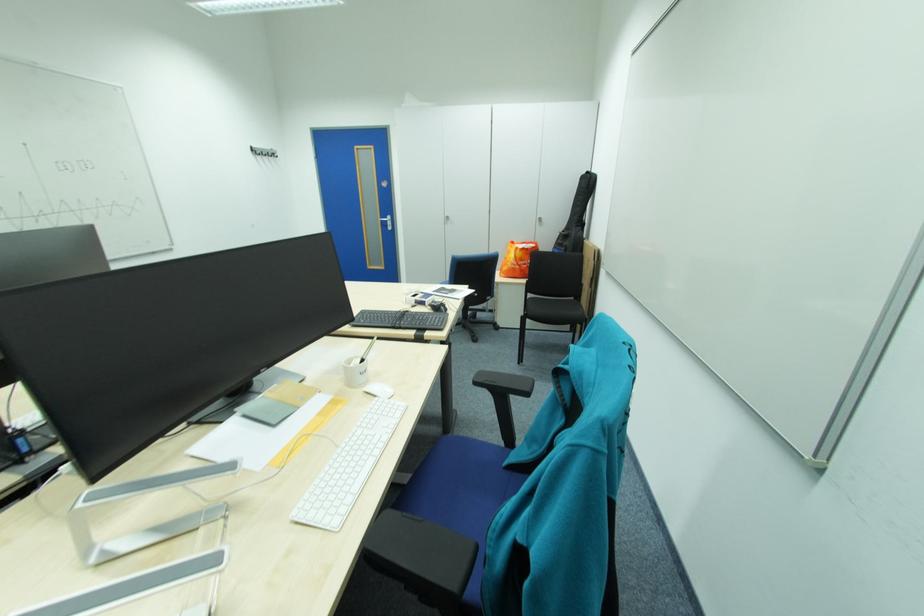
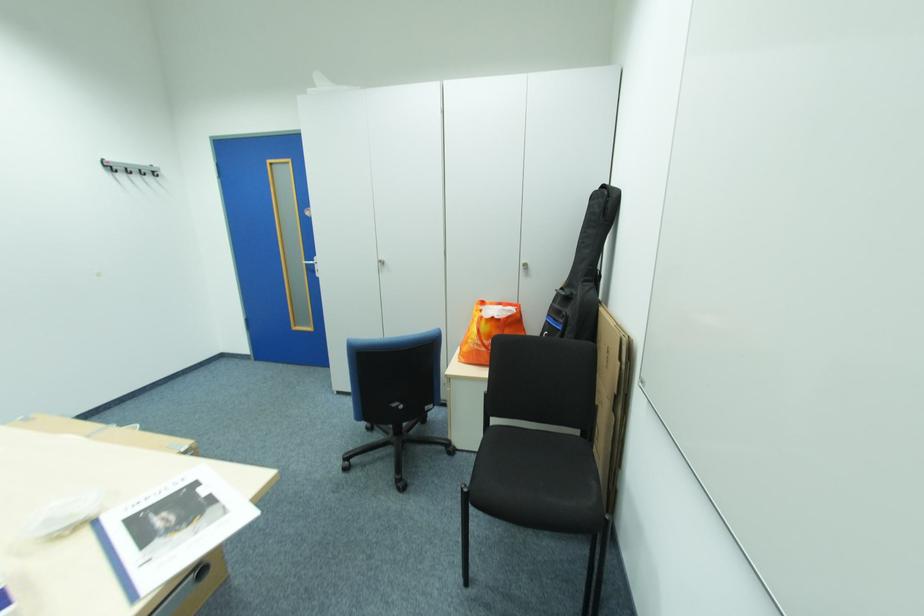
Which direction would the cameraman need to move to produce the second image?

The movement direction of the cameraman is right, forward.